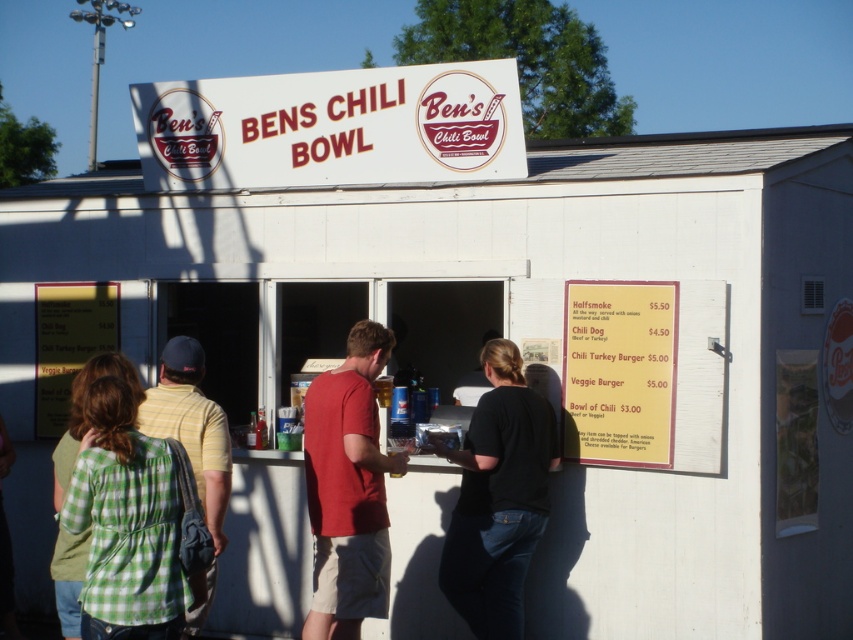
Question: Is green plaid shirt at left to the right of black cotton shirt at center from the viewer's perspective?

Choices:
 (A) no
 (B) yes

Answer: (A)

Question: Which is nearer to the yellow striped shirt at center?

Choices:
 (A) green plaid shirt at left
 (B) red cotton t-shirt at center

Answer: (A)

Question: Does black cotton shirt at center appear on the right side of red cotton t-shirt at center?

Choices:
 (A) no
 (B) yes

Answer: (B)

Question: Does black cotton shirt at center lie in front of red cotton t-shirt at center?

Choices:
 (A) yes
 (B) no

Answer: (B)

Question: Which object is positioned farthest from the green plaid shirt at left?

Choices:
 (A) red cotton t-shirt at center
 (B) yellow striped shirt at center
 (C) black cotton shirt at center

Answer: (C)

Question: Which is nearer to the green plaid shirt at left?

Choices:
 (A) yellow striped shirt at center
 (B) black cotton shirt at center

Answer: (A)